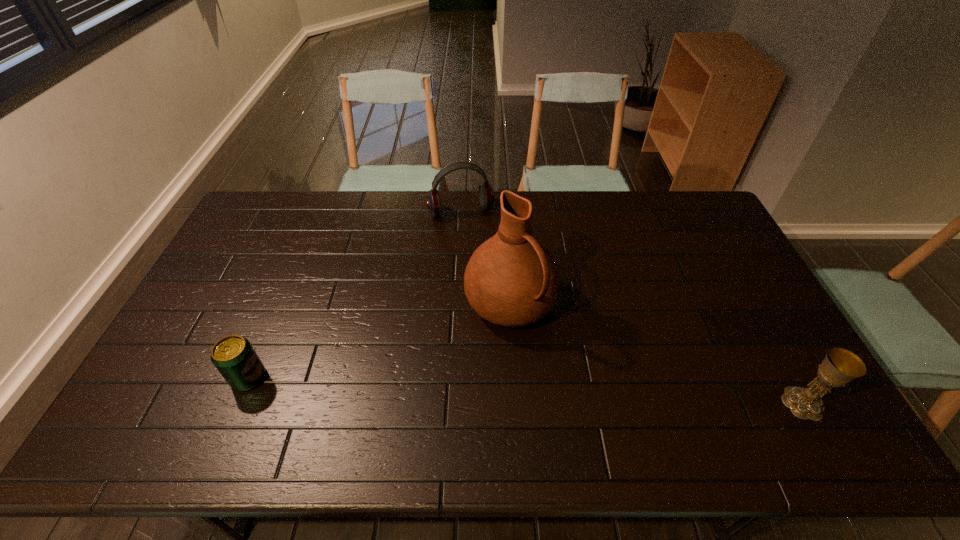
Identify the location of vacant region between the chalice and the earphone. (632, 307).

Where is `free spot between the beer can and the rightmost object`? free spot between the beer can and the rightmost object is located at coordinates (526, 390).

At what (x,y) coordinates should I click in order to perform the action: click on free space that is in between the tallest object and the shortest object. Please return your answer as a coordinate pair (x, y). Looking at the image, I should click on (379, 340).

Locate which object ranks second in proximity to the earphone. Please provide its 2D coordinates. Your answer should be formatted as a tuple, i.e. [(x, y)], where the tuple contains the x and y coordinates of a point satisfying the conditions above.

[(234, 357)]

Locate which object is the second closest to the chalice. Please provide its 2D coordinates. Your answer should be formatted as a tuple, i.e. [(x, y)], where the tuple contains the x and y coordinates of a point satisfying the conditions above.

[(486, 195)]

Where is `blank space that satisfies the following two spatial constraints: 1. on the front side of the chalice; 2. on the left side of the shortest object`? blank space that satisfies the following two spatial constraints: 1. on the front side of the chalice; 2. on the left side of the shortest object is located at coordinates (238, 403).

Find the location of `free space that satisfies the following two spatial constraints: 1. on the front side of the farthest object; 2. on the right side of the chalice`. free space that satisfies the following two spatial constraints: 1. on the front side of the farthest object; 2. on the right side of the chalice is located at coordinates (452, 403).